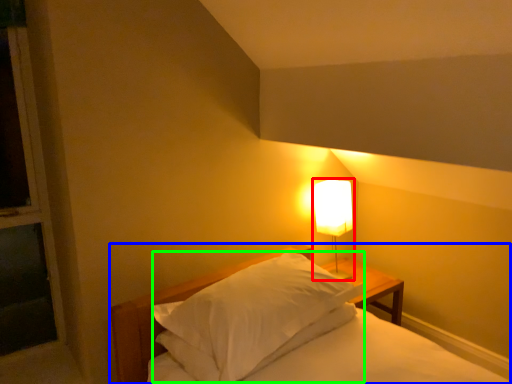
Question: Considering the real-world distances, which object is closest to lamp (highlighted by a red box)? bed (highlighted by a blue box) or pillow (highlighted by a green box).

Choices:
 (A) bed
 (B) pillow

Answer: (A)